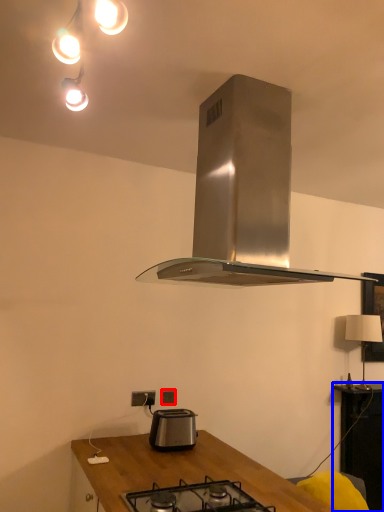
Question: Which point is further to the camera, power plugs and sockets (highlighted by a red box) or table (highlighted by a blue box)?

Choices:
 (A) power plugs and sockets
 (B) table

Answer: (B)